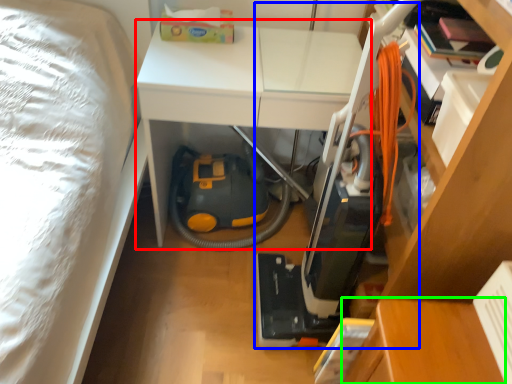
Question: Estimate the real-world distances between objects in this image. Which object is farther from table (highlighted by a red box), vacuum (highlighted by a blue box) or table (highlighted by a green box)?

Choices:
 (A) vacuum
 (B) table

Answer: (B)